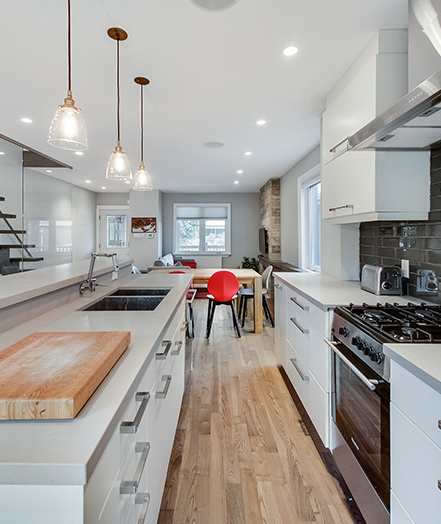
Identify the location of window areas. (313, 233), (213, 236), (191, 232), (115, 232).